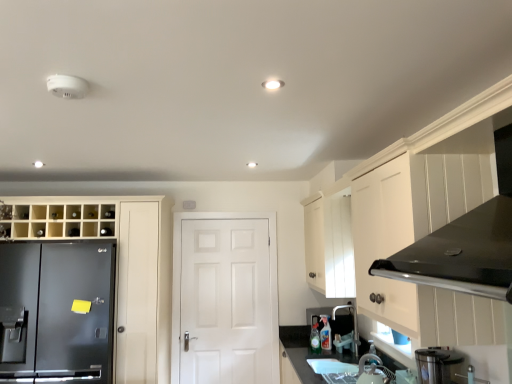
Question: From the image's perspective, is stainless steel blender at lower right, which ranks as the 2th appliance in back-to-front order, beneath smooth granite countertop at lower center?

Choices:
 (A) no
 (B) yes

Answer: (A)

Question: Can you confirm if stainless steel blender at lower right, the first appliance in the top-to-bottom sequence, is smaller than smooth granite countertop at lower center?

Choices:
 (A) no
 (B) yes

Answer: (B)

Question: From a real-world perspective, is stainless steel blender at lower right, the first appliance in the top-to-bottom sequence, physically below smooth granite countertop at lower center?

Choices:
 (A) yes
 (B) no

Answer: (B)

Question: Could smooth granite countertop at lower center be considered to be inside stainless steel blender at lower right, which ranks as the 2th appliance in back-to-front order?

Choices:
 (A) yes
 (B) no

Answer: (B)

Question: Is stainless steel blender at lower right, which ranks as the 2th appliance in back-to-front order, turned away from smooth granite countertop at lower center?

Choices:
 (A) no
 (B) yes

Answer: (A)

Question: Considering the positions of white glossy sink at lower center and smooth granite countertop at lower center in the image, is white glossy sink at lower center bigger or smaller than smooth granite countertop at lower center?

Choices:
 (A) small
 (B) big

Answer: (A)

Question: From a real-world perspective, relative to smooth granite countertop at lower center, is white glossy sink at lower center vertically above or below?

Choices:
 (A) below
 (B) above

Answer: (B)

Question: Is white glossy sink at lower center taller or shorter than smooth granite countertop at lower center?

Choices:
 (A) short
 (B) tall

Answer: (A)

Question: Does point (333, 365) appear closer or farther from the camera than point (284, 334)?

Choices:
 (A) farther
 (B) closer

Answer: (B)

Question: Looking at their shapes, would you say metallic silver faucet at lower right, arranged as the 1th appliance when viewed from the back, is wider or thinner than smooth granite countertop at lower center?

Choices:
 (A) thin
 (B) wide

Answer: (A)

Question: Is metallic silver faucet at lower right, the 1th appliance positioned from the bottom, inside the boundaries of smooth granite countertop at lower center, or outside?

Choices:
 (A) outside
 (B) inside

Answer: (A)

Question: From the image's perspective, is metallic silver faucet at lower right, arranged as the 1th appliance when viewed from the back, located above or below smooth granite countertop at lower center?

Choices:
 (A) below
 (B) above

Answer: (B)

Question: Is metallic silver faucet at lower right, which is the second appliance in top-to-bottom order, to the left or to the right of smooth granite countertop at lower center in the image?

Choices:
 (A) left
 (B) right

Answer: (B)

Question: Is smooth granite countertop at lower center inside the boundaries of clear plastic bottle at lower center, or outside?

Choices:
 (A) outside
 (B) inside

Answer: (A)

Question: Considering their positions, is smooth granite countertop at lower center located in front of or behind clear plastic bottle at lower center?

Choices:
 (A) behind
 (B) front

Answer: (B)